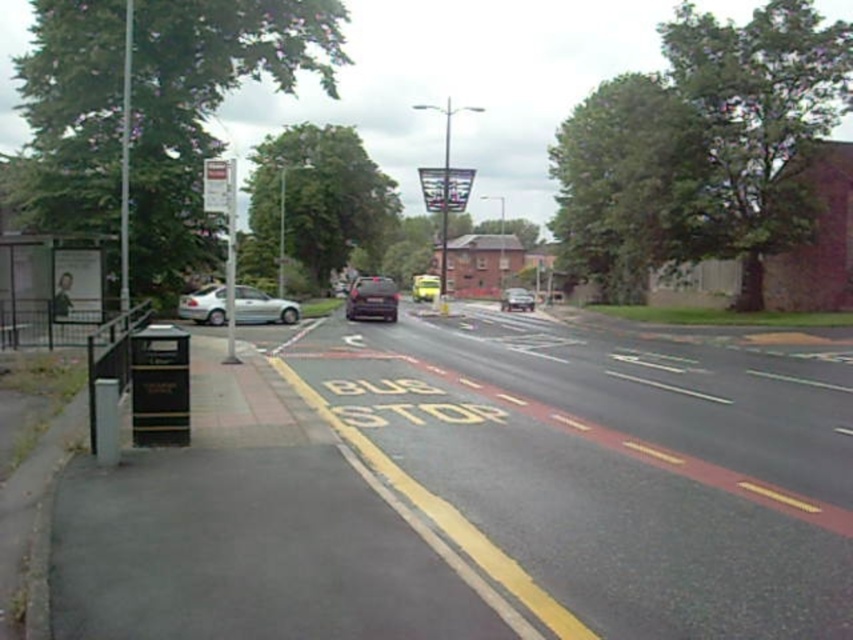
You are a pedestrian on the sidewalk near the bus stop. You see a satin black car at center and a silver metallic car at center. If you want to cross the road to the other side, which car should you wait for to pass first?

The satin black car at center and silver metallic car at center are 16.63 meters apart from each other. Since the cars are far apart, you should wait for both to pass before crossing to ensure safety.

You are a delivery robot navigating the sidewalk near the bus stop. You need to move from the trash bin to the signpost. There are two points marked on your map at coordinates point (370,276) and point (523,305). Which point should you avoid to stay on the sidewalk and follow traffic rules?

You should avoid point (523,305) because point (370,276) is in front of it, meaning point (523,305) is behind and possibly on the road, which is not allowed for the robot to cross.

You are a pedestrian standing on the sidewalk near the black trash bin. You want to cross the street to the bus stop. There are two cars in your path. The silver metallic car at left and the satin black car at center. Can you safely cross between them?

The silver metallic car at left and the satin black car at center are 20.10 feet apart. Since the distance between them is more than enough for a pedestrian to cross safely, you can safely cross between them.